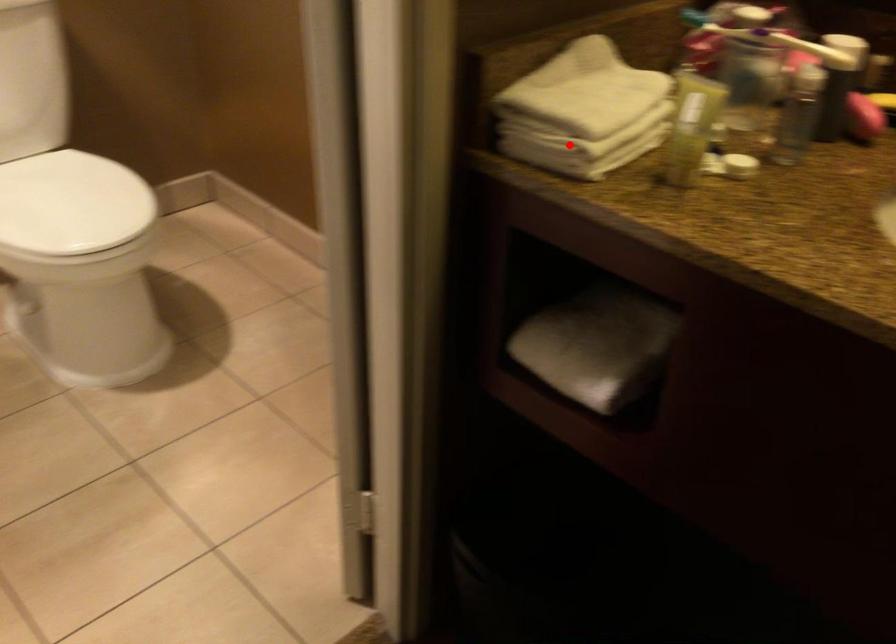
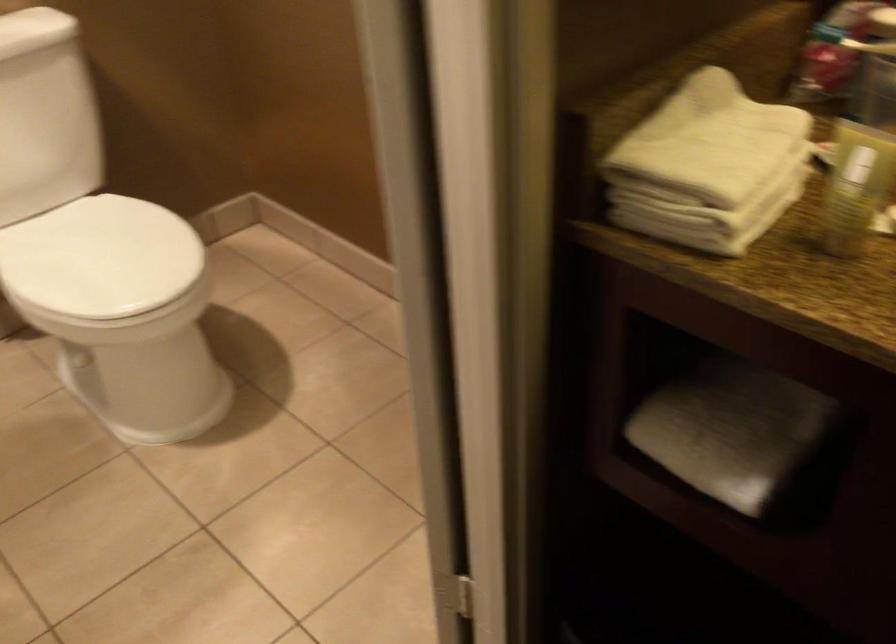
Question: A red point is marked in image1. In image2, is the corresponding 3D point closer to the camera or farther? Reply with the corresponding letter.

Choices:
 (A) The corresponding 3D point is closer.
 (B) The corresponding 3D point is farther.

Answer: (A)